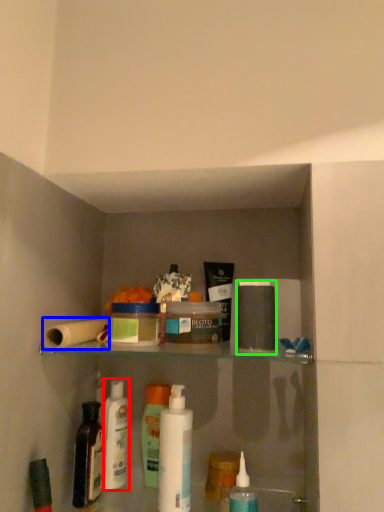
Question: Which is nearer to the cleaning product (highlighted by a red box)? toilet paper (highlighted by a blue box) or toiletry (highlighted by a green box).

Choices:
 (A) toilet paper
 (B) toiletry

Answer: (A)